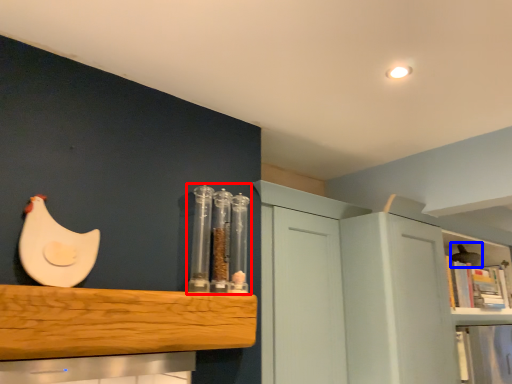
Question: Which point is further to the camera, glass jar (highlighted by a red box) or chicken (highlighted by a blue box)?

Choices:
 (A) glass jar
 (B) chicken

Answer: (B)